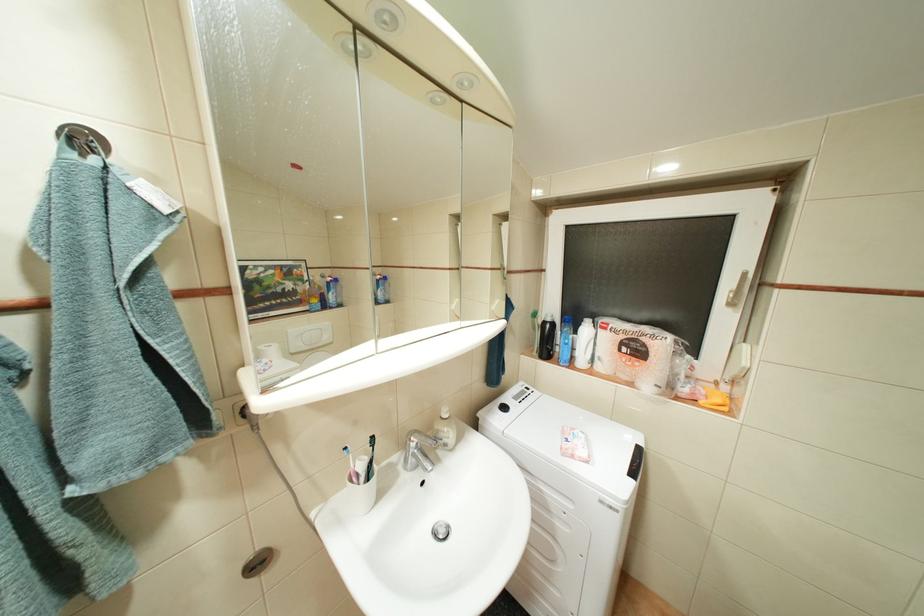
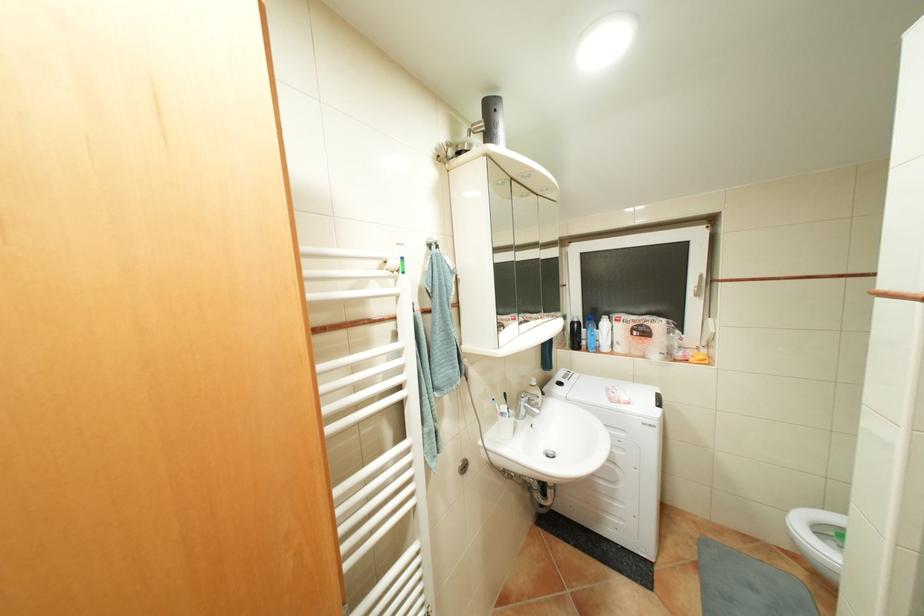
The point at (514,407) is marked in the first image. Where is the corresponding point in the second image?

(569, 383)